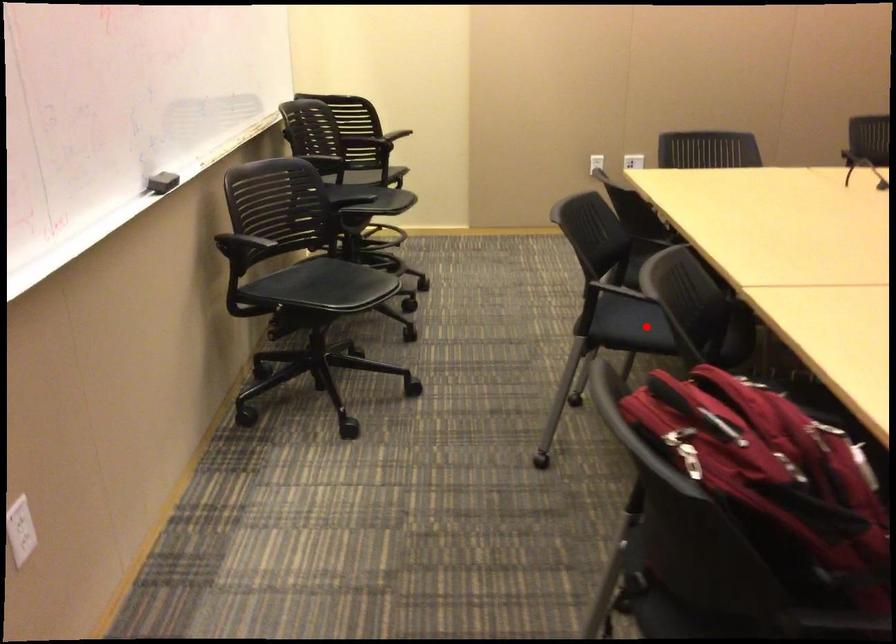
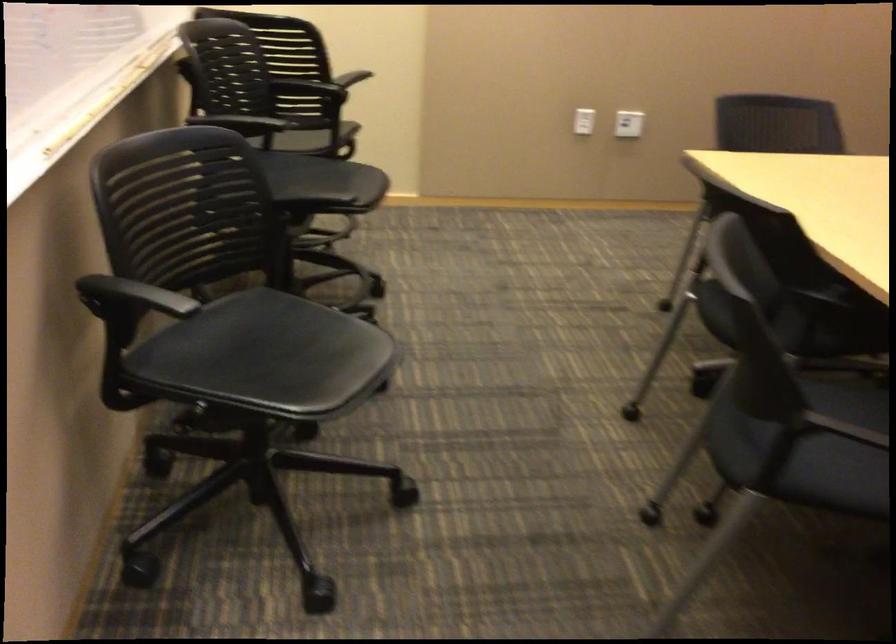
In the second image, find the point that corresponds to the highlighted location in the first image.

(804, 442)